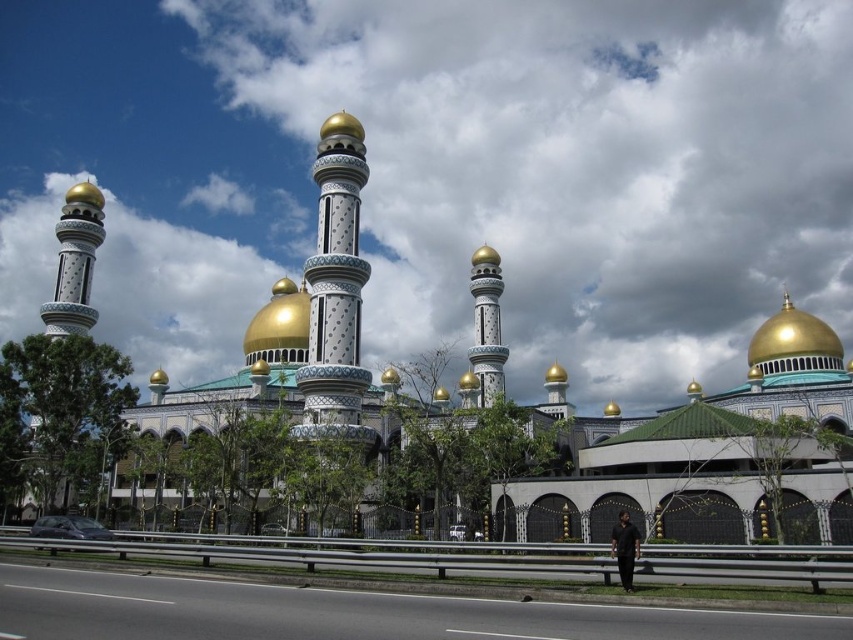
Question: Based on their relative distances, which object is farther from the gold polished tower at center?

Choices:
 (A) gold mosaic minaret at center
 (B) gold polished dome at center
 (C) asphalt road at lower center
 (D) black fabric person at lower center

Answer: (C)

Question: Is gold metallic dome at upper center wider than gold polished dome at center?

Choices:
 (A) yes
 (B) no

Answer: (B)

Question: Among these points, which one is nearest to the camera?

Choices:
 (A) (820, 330)
 (B) (325, 346)
 (C) (267, 348)

Answer: (B)

Question: Does gold polished dome at center appear over black fabric person at lower center?

Choices:
 (A) no
 (B) yes

Answer: (B)

Question: Can you confirm if gold metallic dome at upper center is bigger than gold polished tower at center?

Choices:
 (A) no
 (B) yes

Answer: (A)

Question: Among these points, which one is farthest from the camera?

Choices:
 (A) tap(635, 554)
 (B) tap(265, 612)

Answer: (A)